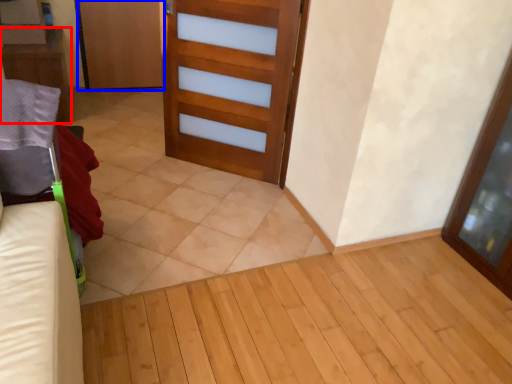
Question: Among these objects, which one is farthest to the camera, furniture (highlighted by a red box) or door (highlighted by a blue box)?

Choices:
 (A) furniture
 (B) door

Answer: (B)